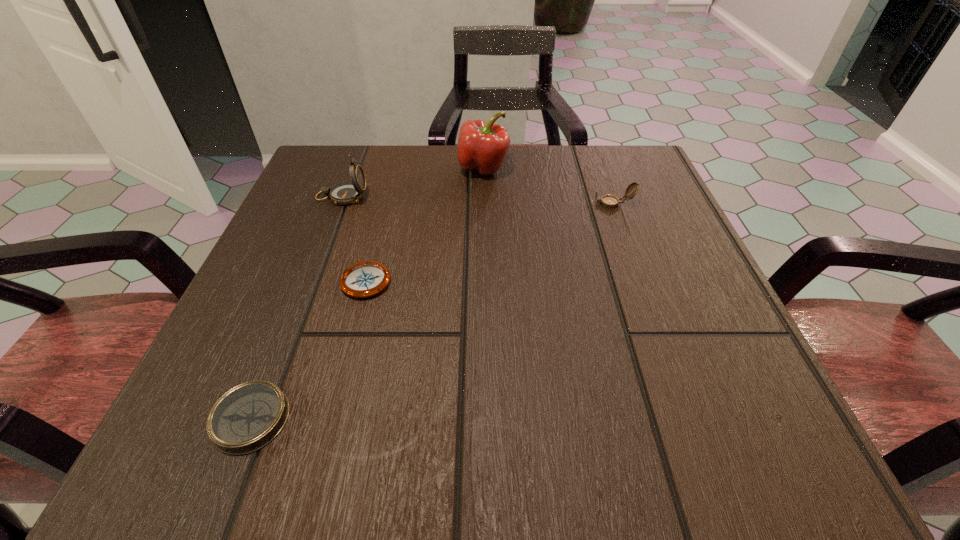
Identify the location of vacant region located on the face of the third shortest object. Image resolution: width=960 pixels, height=540 pixels. (536, 204).

Locate an element on the screen. This screenshot has height=540, width=960. vacant area situated on the face of the third shortest object is located at coordinates (415, 204).

This screenshot has width=960, height=540. Find the location of `vacant space located 0.370m on the face of the third shortest object`. vacant space located 0.370m on the face of the third shortest object is located at coordinates (404, 204).

This screenshot has height=540, width=960. In order to click on vacant space positioned on the back of the second nearest object in this screenshot , I will do [391, 186].

Where is `vacant space located on the back of the nearest object`? Image resolution: width=960 pixels, height=540 pixels. vacant space located on the back of the nearest object is located at coordinates (320, 243).

In order to click on pepper that is at the far edge in this screenshot , I will do `click(482, 147)`.

The width and height of the screenshot is (960, 540). I want to click on object present at the near edge, so click(x=246, y=418).

Where is `object situated at the right edge`? The image size is (960, 540). object situated at the right edge is located at coordinates (608, 201).

The image size is (960, 540). I want to click on object present at the far left corner, so click(345, 193).

Locate an element on the screen. The height and width of the screenshot is (540, 960). object located at the near left corner is located at coordinates (246, 418).